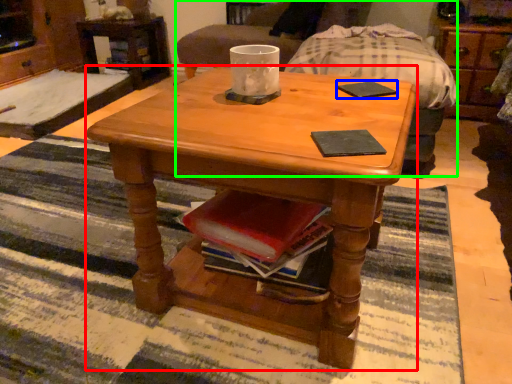
Question: Considering the real-world distances, which object is closest to coffee table (highlighted by a red box)? pad (highlighted by a blue box) or armchair (highlighted by a green box).

Choices:
 (A) pad
 (B) armchair

Answer: (A)